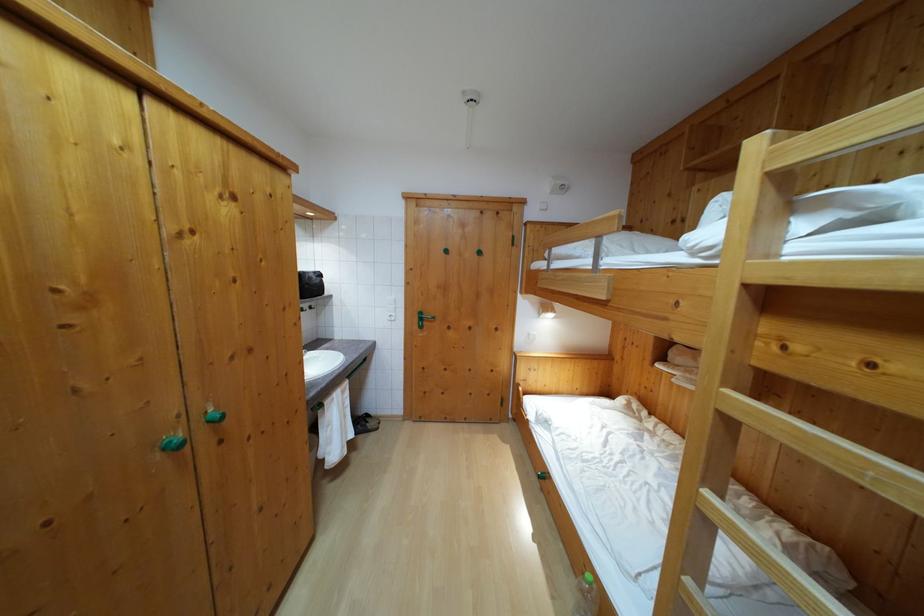
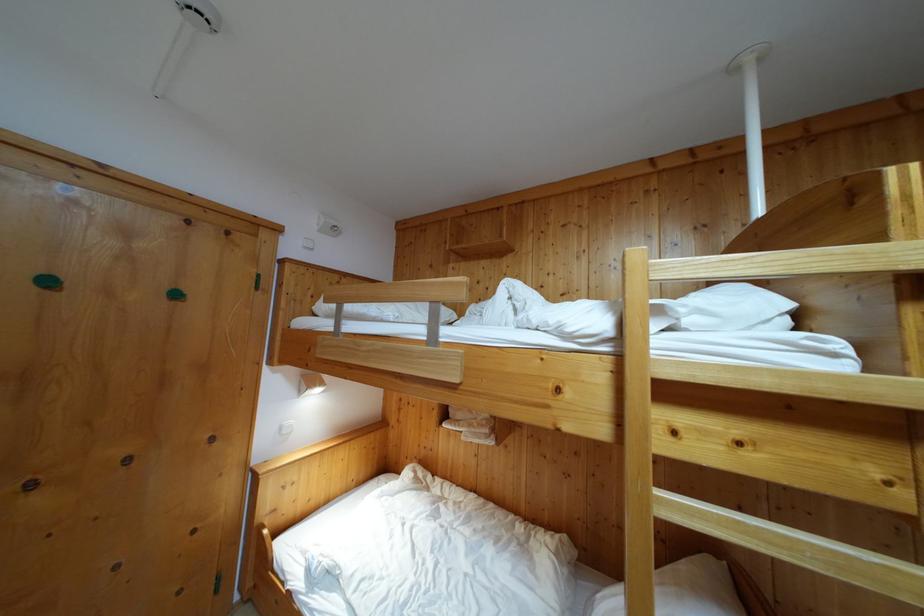
The point at (532, 342) is marked in the first image. Where is the corresponding point in the second image?

(285, 435)